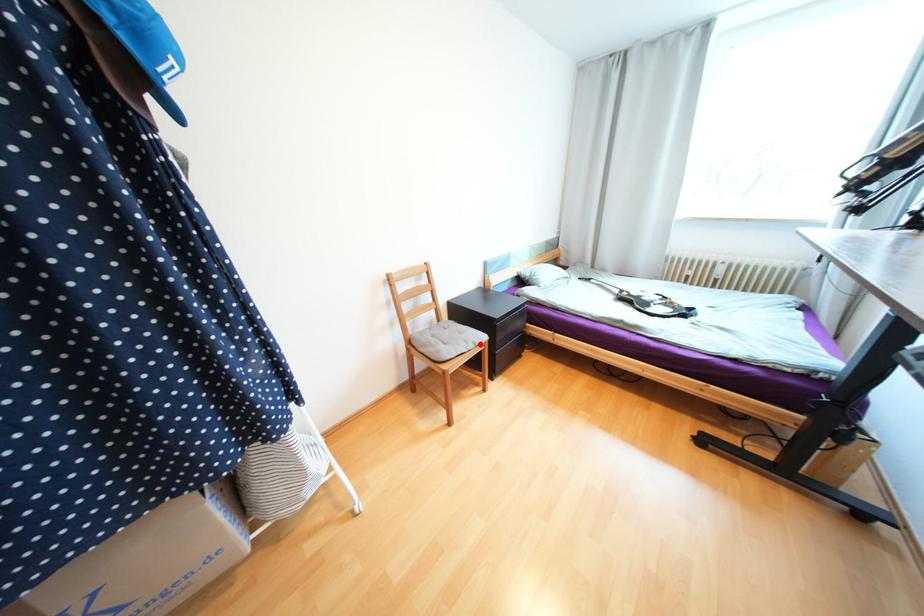
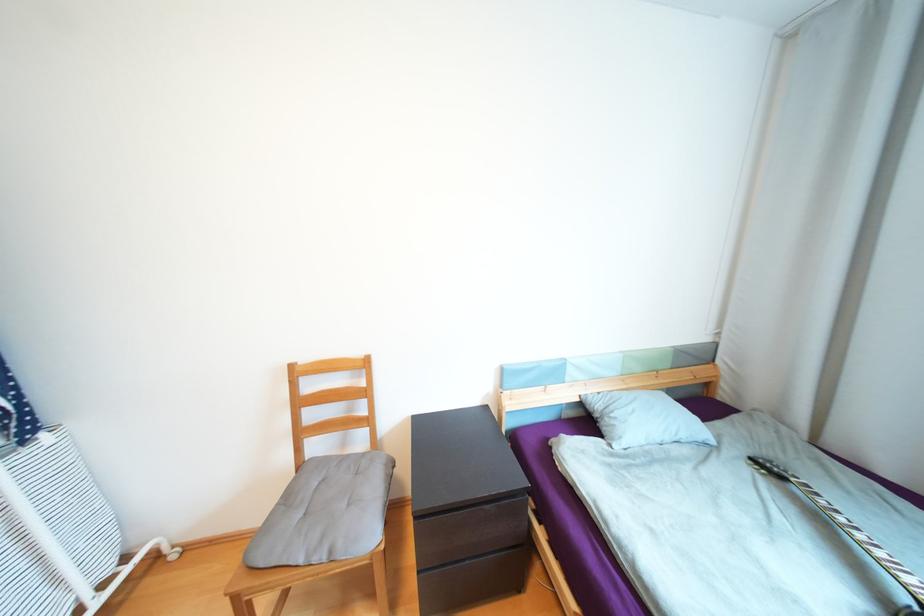
Locate, in the second image, the point that corresponds to the highlighted location in the first image.

(335, 553)